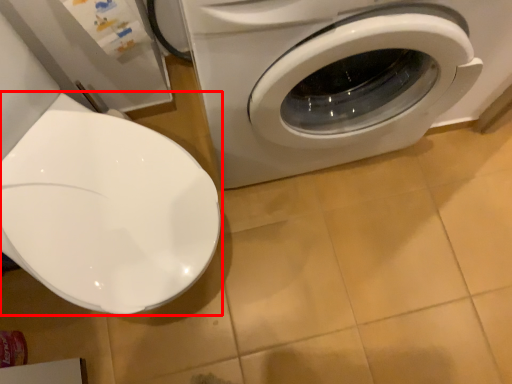
Question: From the image's perspective, where is toilet (annotated by the red box) located in relation to washing machine in the image?

Choices:
 (A) above
 (B) below

Answer: (B)